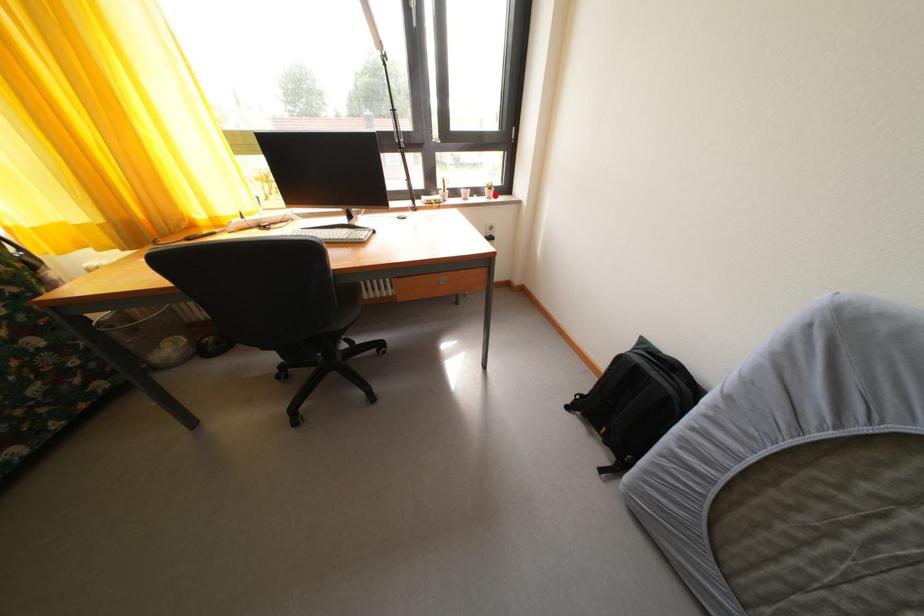
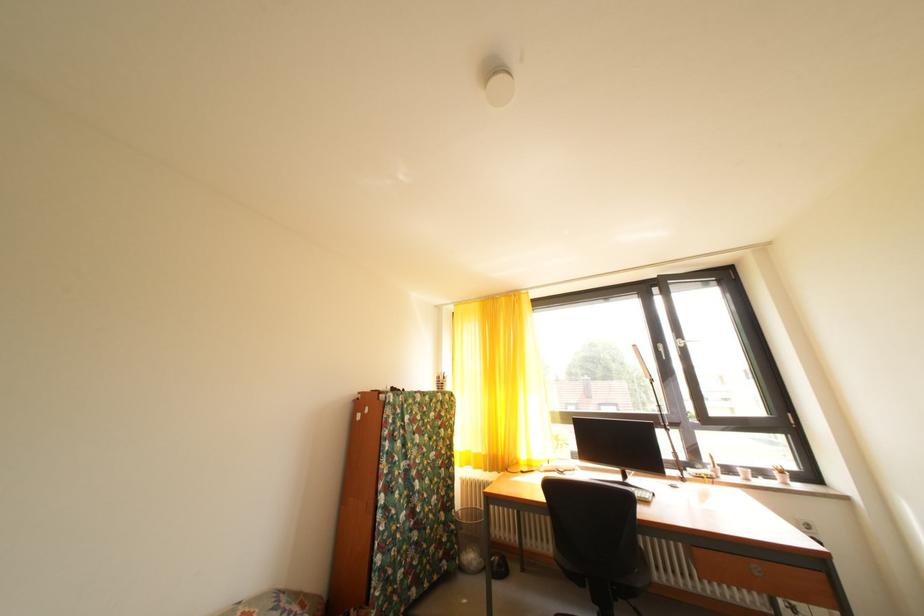
The point at the highlighted location is marked in the first image. Where is the corresponding point in the second image?

(784, 479)